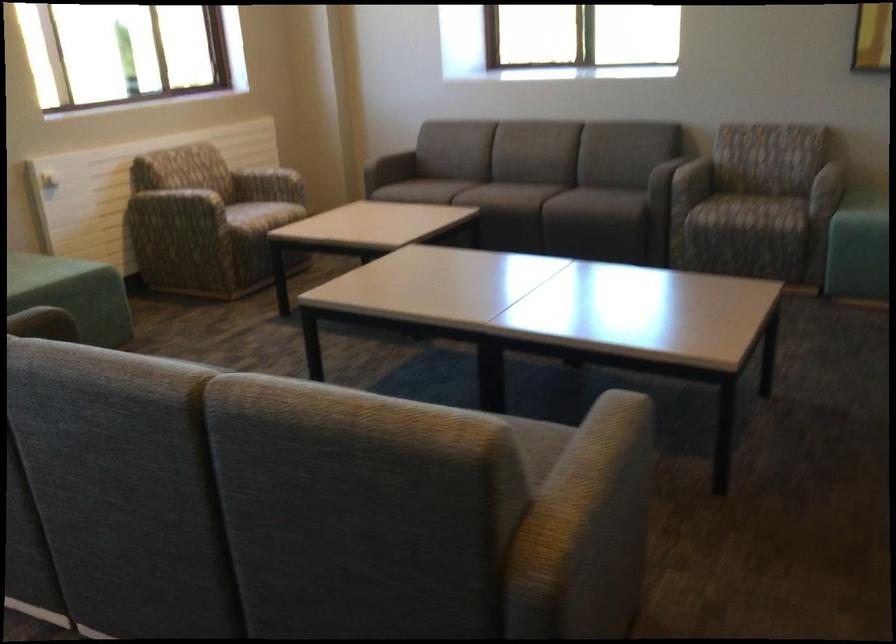
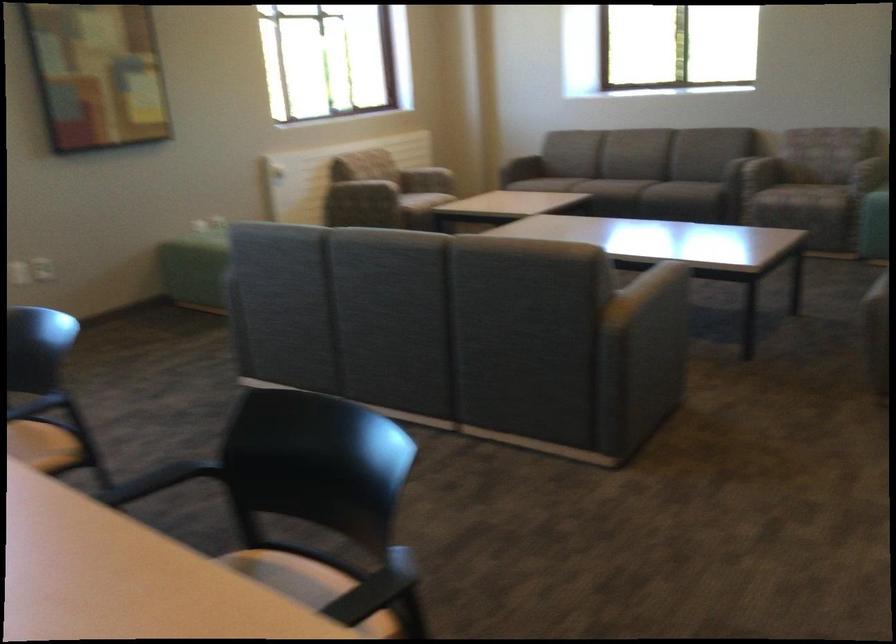
Where in the second image is the point corresponding to pixel 392 178 from the first image?

(522, 167)